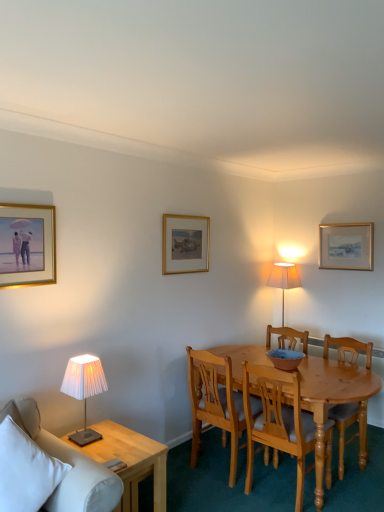
Question: Is light wood side table at lower left thinner than wooden chair at center, the first chair positioned from the right?

Choices:
 (A) yes
 (B) no

Answer: (B)

Question: From the image's perspective, would you say light wood side table at lower left is shown under wooden chair at center, which is the 3th chair from left to right?

Choices:
 (A) no
 (B) yes

Answer: (B)

Question: Does light wood side table at lower left lie in front of wooden chair at center, which is the 3th chair from left to right?

Choices:
 (A) yes
 (B) no

Answer: (A)

Question: Does light wood side table at lower left have a greater width compared to wooden chair at center, the first chair positioned from the right?

Choices:
 (A) no
 (B) yes

Answer: (B)

Question: Is light wood side table at lower left beside wooden chair at center, the first chair positioned from the right?

Choices:
 (A) no
 (B) yes

Answer: (A)

Question: Does point (208, 380) appear closer or farther from the camera than point (276, 355)?

Choices:
 (A) closer
 (B) farther

Answer: (A)

Question: Looking at their shapes, would you say light brown wooden chair at center, arranged as the first chair when viewed from the left, is wider or thinner than matte blue bowl at center?

Choices:
 (A) wide
 (B) thin

Answer: (A)

Question: From the image's perspective, is light brown wooden chair at center, the 3th chair positioned from the right, located above or below matte blue bowl at center?

Choices:
 (A) above
 (B) below

Answer: (B)

Question: Based on their positions, is light brown wooden chair at center, arranged as the first chair when viewed from the left, located to the left or right of matte blue bowl at center?

Choices:
 (A) right
 (B) left

Answer: (B)

Question: Considering the positions of white fabric couch at lower left and gold/gilded picture frame at center, the second picture frame in the back-to-front sequence, in the image, is white fabric couch at lower left wider or thinner than gold/gilded picture frame at center, the second picture frame in the back-to-front sequence,?

Choices:
 (A) wide
 (B) thin

Answer: (A)

Question: Is white fabric couch at lower left taller or shorter than gold/gilded picture frame at center, the second picture frame in the back-to-front sequence?

Choices:
 (A) short
 (B) tall

Answer: (B)

Question: From a real-world perspective, relative to gold/gilded picture frame at center, acting as the second picture frame starting from the front, is white fabric couch at lower left vertically above or below?

Choices:
 (A) below
 (B) above

Answer: (A)

Question: From the image's perspective, relative to gold/gilded picture frame at center, the second picture frame when ordered from left to right, is white fabric couch at lower left above or below?

Choices:
 (A) below
 (B) above

Answer: (A)

Question: Does point (297, 352) appear closer or farther from the camera than point (190, 364)?

Choices:
 (A) farther
 (B) closer

Answer: (A)

Question: From a real-world perspective, is matte blue bowl at center positioned above or below light brown wooden chair at center, arranged as the first chair when viewed from the left?

Choices:
 (A) above
 (B) below

Answer: (A)